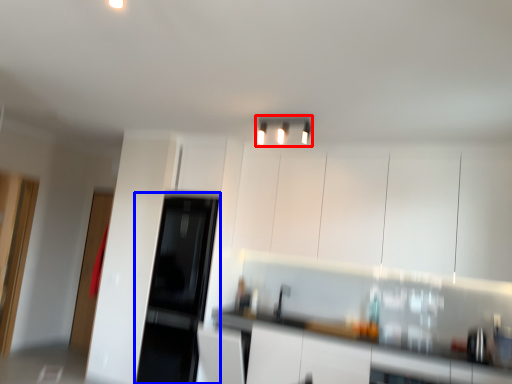
Question: Which object is further to the camera taking this photo, light fixture (highlighted by a red box) or appliance (highlighted by a blue box)?

Choices:
 (A) light fixture
 (B) appliance

Answer: (B)